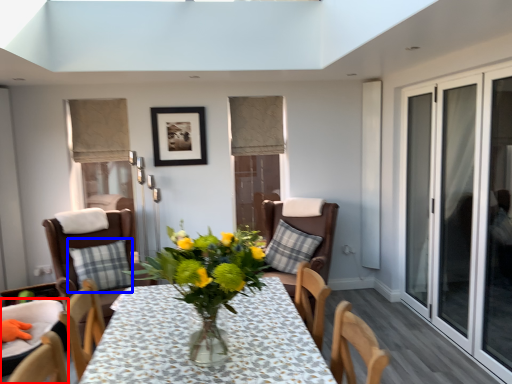
Question: Among these objects, which one is farthest to the camera, chair (highlighted by a red box) or pillow (highlighted by a blue box)?

Choices:
 (A) chair
 (B) pillow

Answer: (B)